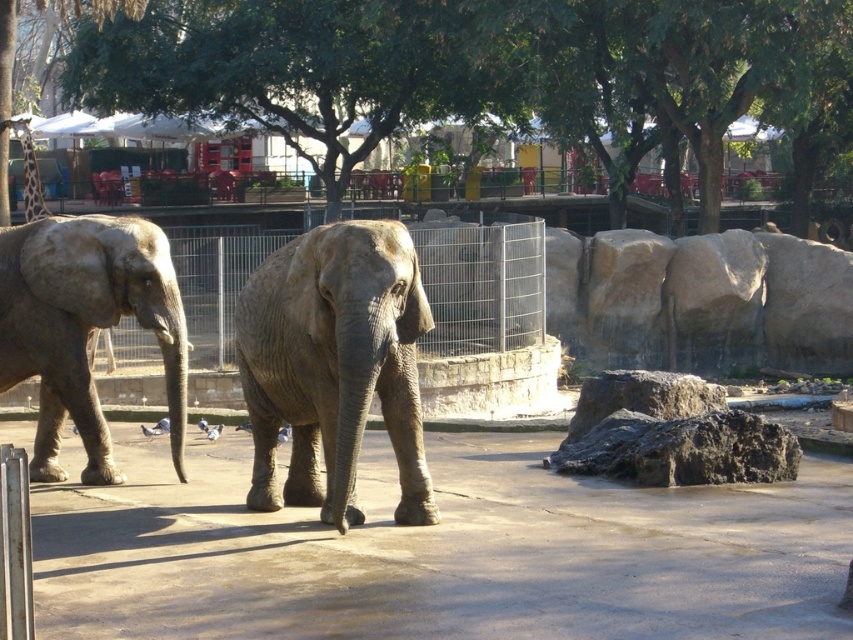
Is point (357, 45) closer to viewer compared to point (380, 260)?

No, it is behind (380, 260).

What are the coordinates of `green leafy tree at upper center` in the screenshot? It's located at (x=308, y=67).

What do you see at coordinates (308, 67) in the screenshot?
I see `green leafy tree at upper center` at bounding box center [308, 67].

The width and height of the screenshot is (853, 640). In order to click on green leafy tree at upper center in this screenshot , I will do `click(308, 67)`.

Can you confirm if gray matte elephant at left is wider than metal wire fence at center?

Yes.

Does point (117, 220) lie behind point (460, 349)?

No, (117, 220) is in front of (460, 349).

This screenshot has height=640, width=853. Identify the location of gray matte elephant at left. (85, 324).

Is green leafy tree at upper center to the right of gray matte elephant at left from the viewer's perspective?

In fact, green leafy tree at upper center is to the left of gray matte elephant at left.

Between green leafy tree at upper center and gray matte elephant at left, which one appears on the left side from the viewer's perspective?

Positioned to the left is green leafy tree at upper center.

The height and width of the screenshot is (640, 853). What do you see at coordinates (308, 67) in the screenshot? I see `green leafy tree at upper center` at bounding box center [308, 67].

Locate an element on the screen. green leafy tree at upper center is located at coordinates (308, 67).